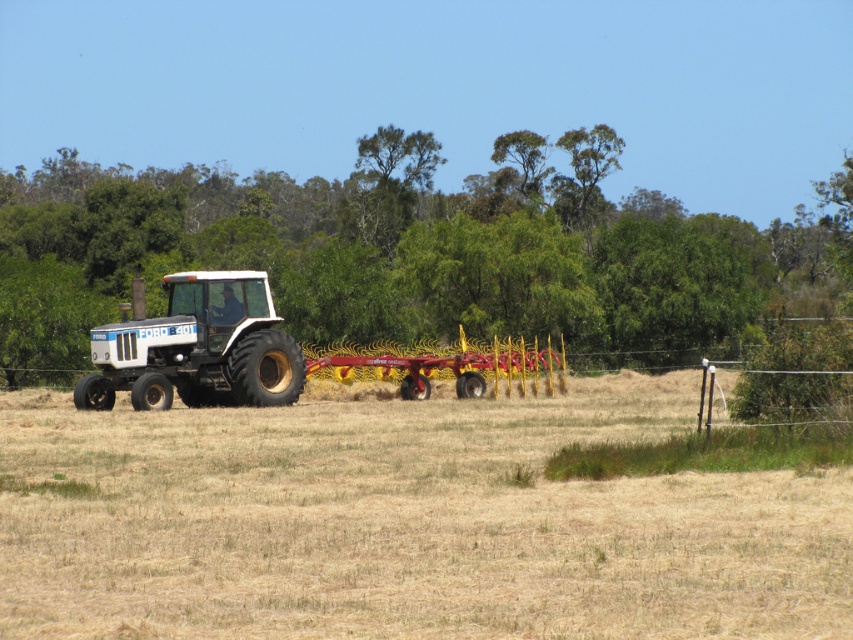
You are a farmer who needs to move the white matte tractor at left to the dry straw at center to collect it. Given the tractor has a turning radius of 10 feet, can you safely navigate the tractor to the straw without damaging the surrounding dry field?

The distance between the dry straw at center and the white matte tractor at left is 12.39 feet. Since the tractor has a turning radius of 10 feet, it can safely navigate to the straw as the required space is less than the available distance. However, ensure the path is clear of any unseen obstacles to avoid damaging the dry field.

You are a farmer checking the field layout. You see the dry straw at center and the white matte tractor at left. Which object is positioned lower in the scene?

The dry straw at center is positioned below the white matte tractor at left, so it is lower in the scene.

You are a farmer planning to move the white matte tractor at center to the right side of the field. However, there is another tractor, the white matte tractor at left, parked nearby. Based on their positions, can you determine if there is enough space between them to maneuver the tractor safely?

The white matte tractor at center is located above the white matte tractor at left, meaning they are positioned vertically relative to each other. Since they are not side by side horizontally, there should be sufficient space between them to safely maneuver the tractor to the right side of the field.